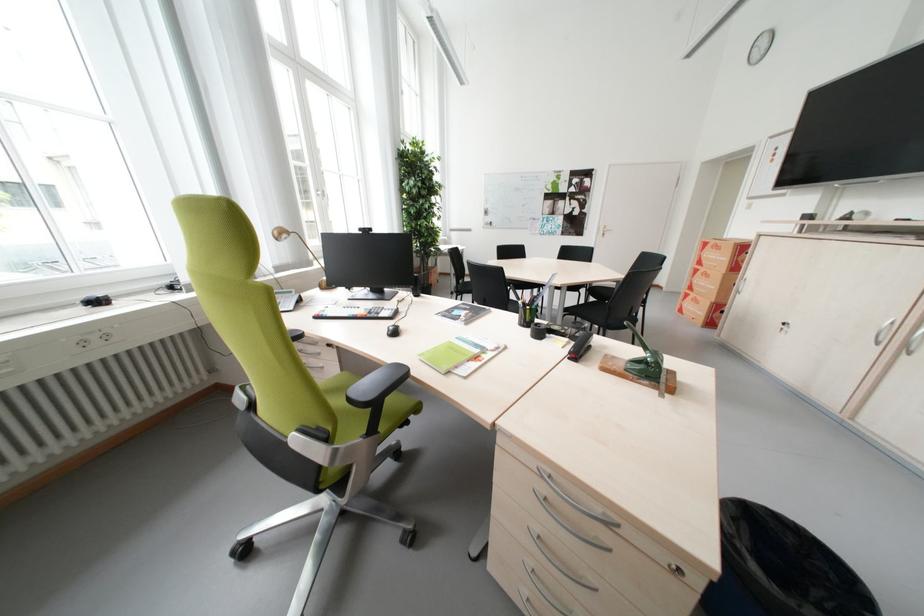
Locate an element on the screen. The image size is (924, 616). green notebook is located at coordinates (448, 355).